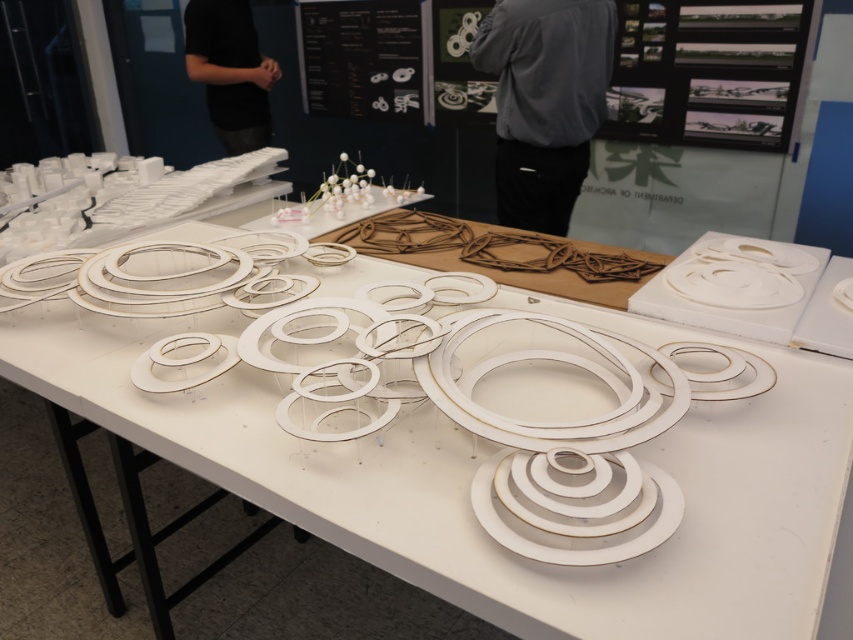
Question: Is black paper at upper center closer to the viewer compared to black shirt at upper left?

Choices:
 (A) no
 (B) yes

Answer: (B)

Question: Which is nearer to the black paper at upper center?

Choices:
 (A) white matte plate at center
 (B) white cardboard circles at center

Answer: (B)

Question: Which point appears farthest from the camera in this image?

Choices:
 (A) (247, 131)
 (B) (601, 92)
 (C) (175, 369)
 (D) (363, 100)

Answer: (A)

Question: Is the position of gray fabric pants at center less distant than that of black shirt at upper left?

Choices:
 (A) no
 (B) yes

Answer: (B)

Question: Does black paper at upper center have a greater width compared to white cardboard plate at center?

Choices:
 (A) no
 (B) yes

Answer: (B)

Question: Which object is the farthest from the white cardboard plate at center?

Choices:
 (A) gray fabric pants at center
 (B) white matte plate at center

Answer: (A)